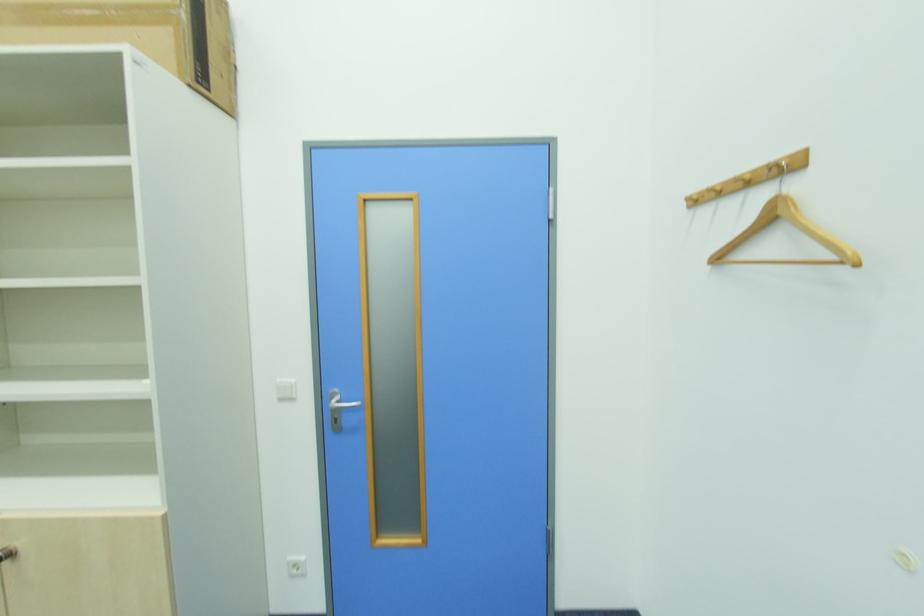
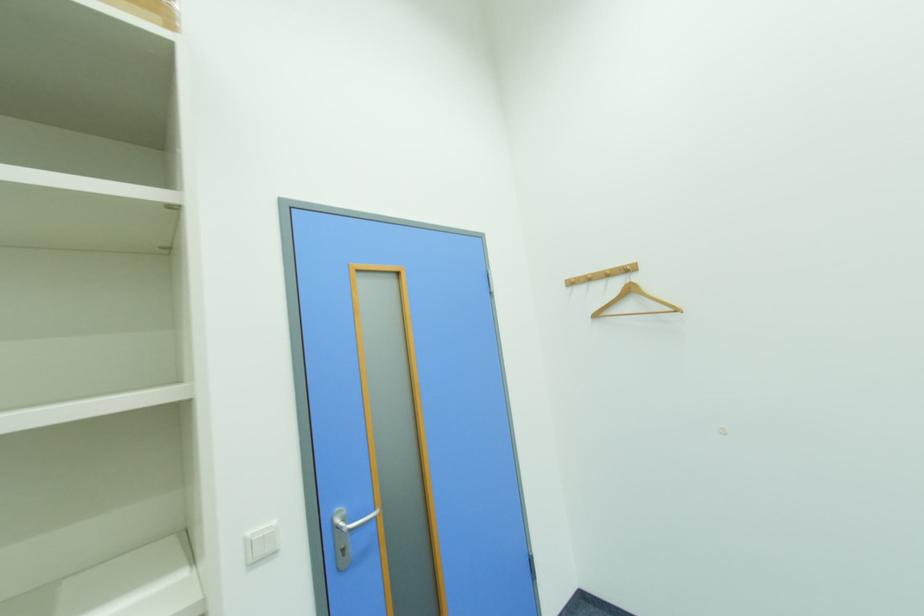
In the second image, find the point that corresponds to pixel 722 262 in the first image.

(601, 317)